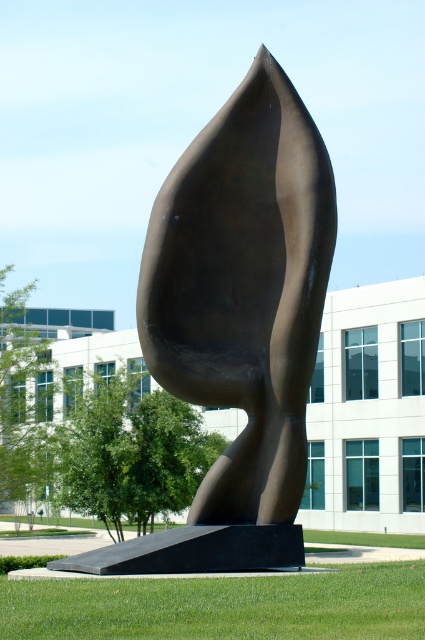
You are standing at the camera position and want to walk directly to the point labeled as point [124,548]. How far will you have to walk?

You will have to walk 56.80 feet to reach the point labeled as point [124,548] from the camera position.

You are a photographer standing in the park and want to capture both the bronze sculpture at center and the green grass at lower center in a single shot. Which object will appear closer to the camera in the photo?

The bronze sculpture at center will appear closer to the camera because it is further to the viewer than the green grass at lower center, meaning it is positioned in front of the grass in the scene.